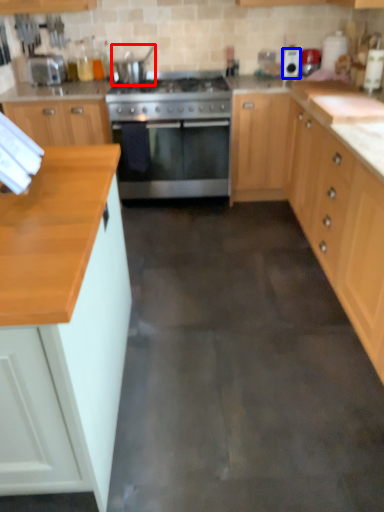
Question: Which point is further to the camera, appliance (highlighted by a red box) or appliance (highlighted by a blue box)?

Choices:
 (A) appliance
 (B) appliance

Answer: (B)